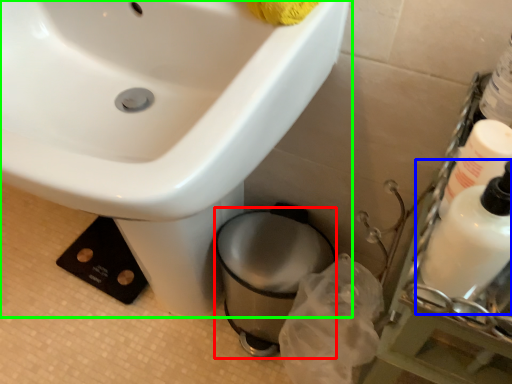
Question: Which is nearer to the toilet bowl (highlighted by a red box)? cleaning product (highlighted by a blue box) or sink (highlighted by a green box).

Choices:
 (A) cleaning product
 (B) sink

Answer: (B)